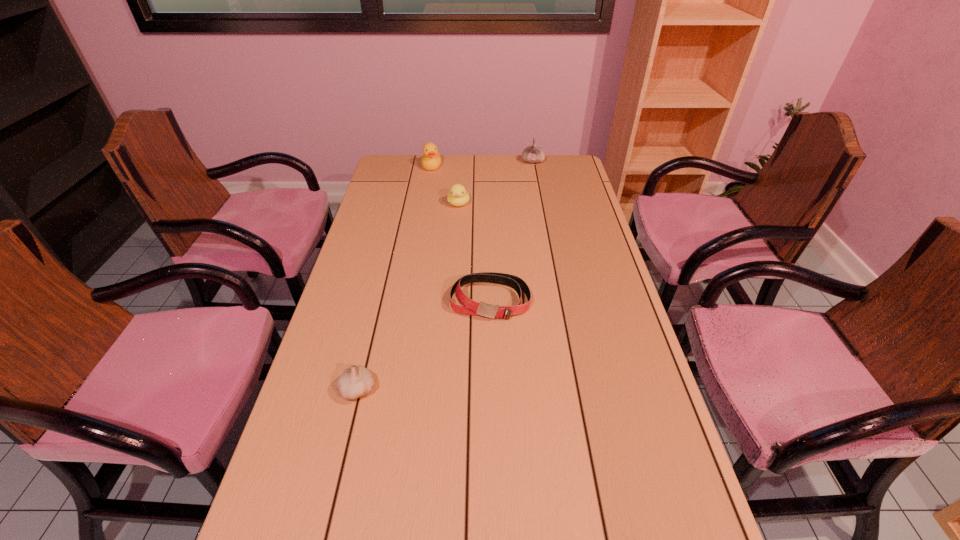
Locate an element on the screen. The image size is (960, 540). blank space located on the right of the left garlic is located at coordinates (402, 390).

This screenshot has height=540, width=960. What are the coordinates of `vacant space located 0.320m on the back of the dog collar` in the screenshot? It's located at (489, 221).

At what (x,y) coordinates should I click in order to perform the action: click on garlic that is positioned at the far edge. Please return your answer as a coordinate pair (x, y). Looking at the image, I should click on (533, 154).

Find the location of `duck positioned at the far edge`. duck positioned at the far edge is located at coordinates (431, 160).

Find the location of a particular element. object positioned at the left edge is located at coordinates (356, 381).

This screenshot has width=960, height=540. Find the location of `object located at the right edge`. object located at the right edge is located at coordinates (533, 154).

At what (x,y) coordinates should I click in order to perform the action: click on object present at the far right corner. Please return your answer as a coordinate pair (x, y). This screenshot has height=540, width=960. Looking at the image, I should click on (533, 154).

In the image, there is a desktop. Identify the location of vacant space at the far edge. (486, 168).

This screenshot has width=960, height=540. Identify the location of free space at the left edge of the desktop. (349, 341).

The width and height of the screenshot is (960, 540). In the image, there is a desktop. Identify the location of vacant space at the right edge. (592, 316).